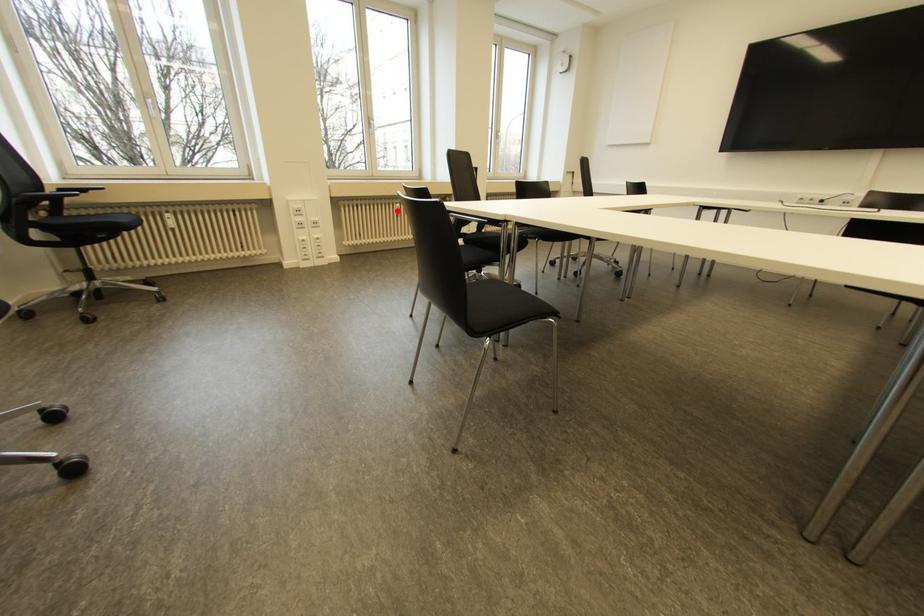
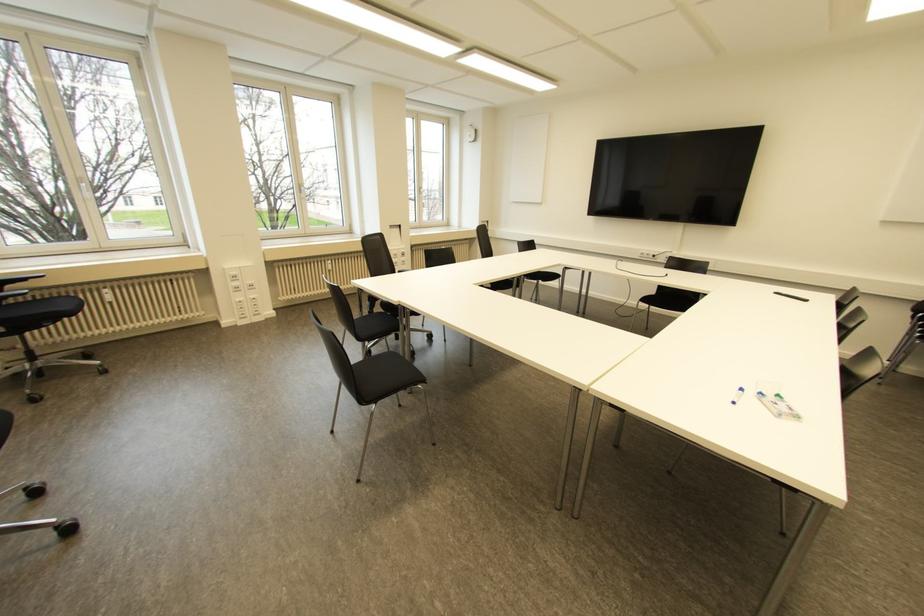
Question: A red point is marked in image1. In image2, is the corresponding 3D point closer to the camera or farther? Reply with the corresponding letter.

Choices:
 (A) The corresponding 3D point is closer.
 (B) The corresponding 3D point is farther.

Answer: (B)